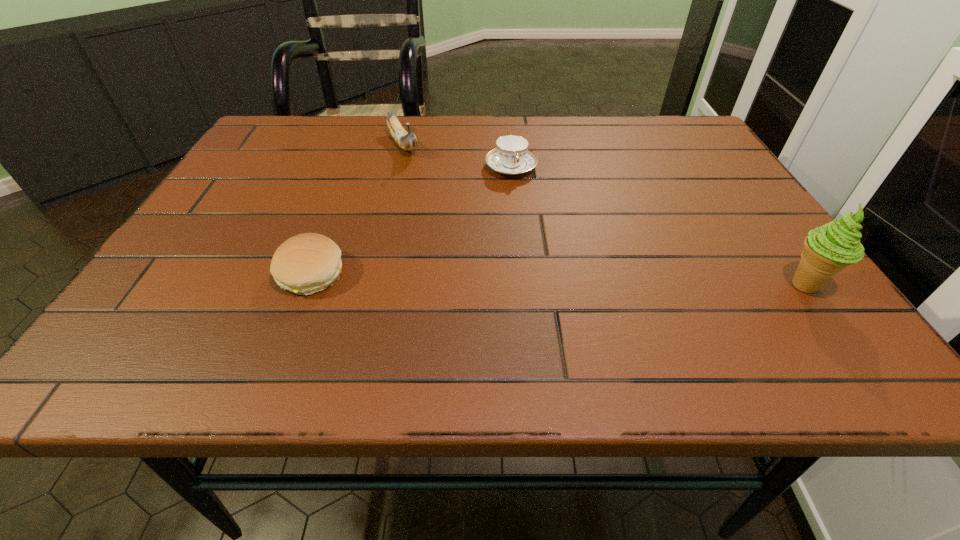
The height and width of the screenshot is (540, 960). I want to click on blank area at the far edge, so click(x=591, y=120).

Identify the location of vacant space at the near edge of the desktop. The width and height of the screenshot is (960, 540). (238, 325).

This screenshot has height=540, width=960. In the image, there is a desktop. Find the location of `free space at the left edge`. free space at the left edge is located at coordinates (266, 191).

Find the location of a particular element. Image resolution: width=960 pixels, height=540 pixels. free spot at the right edge of the desktop is located at coordinates (703, 214).

Locate an element on the screen. The image size is (960, 540). vacant space at the near left corner is located at coordinates (206, 308).

Locate an element on the screen. This screenshot has width=960, height=540. free space at the far right corner of the desktop is located at coordinates (679, 137).

Where is `vacant area that lies between the banana and the rightmost object`? The width and height of the screenshot is (960, 540). vacant area that lies between the banana and the rightmost object is located at coordinates (604, 215).

You are a GUI agent. You are given a task and a screenshot of the screen. Output one action in this format:
    pyautogui.click(x=<x>, y=<y>)
    Task: Click on the free space between the banana and the teacup
    The height and width of the screenshot is (540, 960).
    Given the screenshot: What is the action you would take?
    pyautogui.click(x=457, y=157)

The width and height of the screenshot is (960, 540). I want to click on free space between the second object from right to left and the patty, so click(x=411, y=220).

Where is `empty space that is in between the teacup and the third shortest object`? empty space that is in between the teacup and the third shortest object is located at coordinates tap(457, 157).